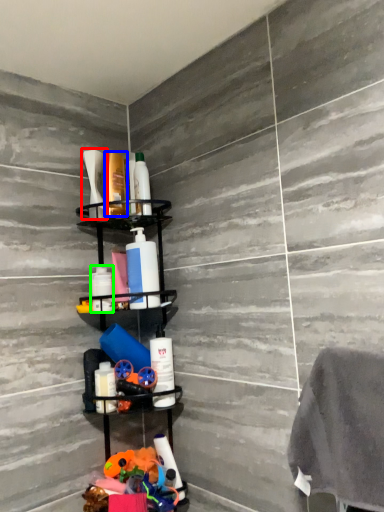
Question: Which object is positioned closest to toiletry (highlighted by a red box)? Select from toiletry (highlighted by a blue box) and toiletry (highlighted by a green box).

Choices:
 (A) toiletry
 (B) toiletry

Answer: (A)